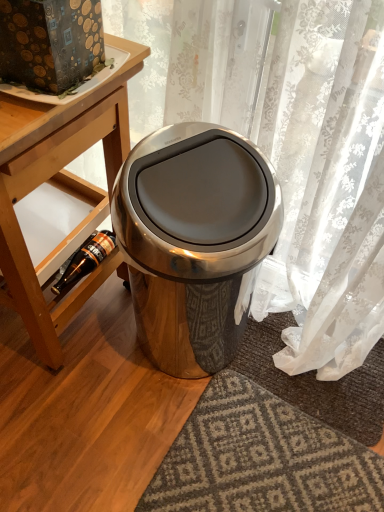
Question: From the image's perspective, would you say wooden shelf at lower left is shown under wooden table at lower left?

Choices:
 (A) no
 (B) yes

Answer: (B)

Question: Is wooden shelf at lower left bigger than wooden table at lower left?

Choices:
 (A) no
 (B) yes

Answer: (A)

Question: From the image's perspective, is wooden shelf at lower left located above wooden table at lower left?

Choices:
 (A) no
 (B) yes

Answer: (A)

Question: Is wooden shelf at lower left wider than wooden table at lower left?

Choices:
 (A) no
 (B) yes

Answer: (A)

Question: Is wooden shelf at lower left at the left side of wooden table at lower left?

Choices:
 (A) no
 (B) yes

Answer: (A)

Question: Can you confirm if wooden shelf at lower left is smaller than wooden table at lower left?

Choices:
 (A) yes
 (B) no

Answer: (A)

Question: From the image's perspective, is wooden shelf at lower left over satin metallic trash can at center?

Choices:
 (A) no
 (B) yes

Answer: (B)

Question: From a real-world perspective, is wooden shelf at lower left located higher than satin metallic trash can at center?

Choices:
 (A) no
 (B) yes

Answer: (A)

Question: Is wooden shelf at lower left positioned in front of satin metallic trash can at center?

Choices:
 (A) yes
 (B) no

Answer: (B)

Question: Is wooden shelf at lower left aimed at satin metallic trash can at center?

Choices:
 (A) no
 (B) yes

Answer: (A)

Question: Does wooden shelf at lower left appear on the left side of satin metallic trash can at center?

Choices:
 (A) yes
 (B) no

Answer: (A)

Question: Is wooden shelf at lower left wider than satin metallic trash can at center?

Choices:
 (A) no
 (B) yes

Answer: (B)

Question: Can you confirm if satin metallic trash can at center is positioned to the right of wooden table at lower left?

Choices:
 (A) no
 (B) yes

Answer: (B)